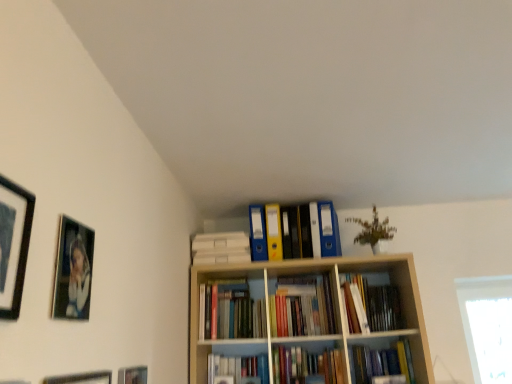
How much space does matte black picture frame at lower left, which is the third picture frame in top-to-bottom order, occupy vertically?

matte black picture frame at lower left, which is the third picture frame in top-to-bottom order, is 5.63 inches tall.

What do you see at coordinates (375, 304) in the screenshot? I see `hardcover books at center, which is the 2th book from bottom to top` at bounding box center [375, 304].

This screenshot has width=512, height=384. Describe the element at coordinates (382, 362) in the screenshot. I see `hardcover book at center, the 1th book when ordered from bottom to top` at that location.

Identify the location of matte plastic folders at upper center, the first book positioned from the top. (294, 231).

What do you see at coordinates (14, 246) in the screenshot? I see `matte black picture frame at upper left, the 4th picture frame when ordered from bottom to top` at bounding box center [14, 246].

Locate an element on the screen. This screenshot has width=512, height=384. matte black picture frame at lower left, which is the 2th picture frame in bottom-to-top order is located at coordinates (133, 375).

Which is behind, matte plastic folders at upper center, which is counted as the 3th book, starting from the bottom, or hardcover book at center, the 1th book when ordered from bottom to top?

matte plastic folders at upper center, which is counted as the 3th book, starting from the bottom, is further from the camera.

Looking at this image, from the image's perspective, is matte plastic folders at upper center, the first book positioned from the top, positioned above or below hardcover book at center, which appears as the 3th book when viewed from the top?

From the image's perspective, matte plastic folders at upper center, the first book positioned from the top, appears above hardcover book at center, which appears as the 3th book when viewed from the top.

From the picture: Between matte plastic folders at upper center, which is counted as the 3th book, starting from the bottom, and hardcover book at center, the 1th book when ordered from bottom to top, which one has less height?

Standing shorter between the two is hardcover book at center, the 1th book when ordered from bottom to top.

Identify the location of book that is the 2nd object located above the hardcover book at center, which appears as the 3th book when viewed from the top (from the image's perspective). The height and width of the screenshot is (384, 512). (294, 231).

Could you tell me if matte plastic folders at upper center, the first book positioned from the top, is facing hardcover books at center, arranged as the second book when viewed from the top?

No, matte plastic folders at upper center, the first book positioned from the top, is not turned towards hardcover books at center, arranged as the second book when viewed from the top.

Between matte plastic folders at upper center, which is counted as the 3th book, starting from the bottom, and hardcover books at center, arranged as the second book when viewed from the top, which one has smaller width?

With smaller width is matte plastic folders at upper center, which is counted as the 3th book, starting from the bottom.

Which is nearer, (274,231) or (367,319)?

The point (367,319) is in front.

The image size is (512, 384). I want to click on the 1st book located beneath the matte plastic folders at upper center, the first book positioned from the top (from a real-world perspective), so click(x=375, y=304).

From a real-world perspective, who is located lower, matte black picture frame at lower left, which is the third picture frame in top-to-bottom order, or hardcover books at center, which is the 2th book from bottom to top?

matte black picture frame at lower left, which is the third picture frame in top-to-bottom order, from a real-world perspective.

Does matte black picture frame at lower left, which is the 2th picture frame in bottom-to-top order, contain hardcover books at center, which is the 2th book from bottom to top?

No, hardcover books at center, which is the 2th book from bottom to top, is not a part of matte black picture frame at lower left, which is the 2th picture frame in bottom-to-top order.

Is matte black picture frame at lower left, which is the 2th picture frame in bottom-to-top order, shorter than hardcover books at center, which is the 2th book from bottom to top?

Indeed, matte black picture frame at lower left, which is the 2th picture frame in bottom-to-top order, has a lesser height compared to hardcover books at center, which is the 2th book from bottom to top.

How distant is matte black picture frame at upper left, the 4th picture frame when ordered from bottom to top, from metallic silver picture frame at upper left, marked as the second picture frame in a top-to-bottom arrangement?

6.16 inches.

Does matte black picture frame at upper left, the 4th picture frame when ordered from bottom to top, turn towards metallic silver picture frame at upper left, marked as the second picture frame in a top-to-bottom arrangement?

No.

Is matte black picture frame at upper left, positioned as the 1th picture frame in top-to-bottom order, smaller than metallic silver picture frame at upper left, marked as the second picture frame in a top-to-bottom arrangement?

No, matte black picture frame at upper left, positioned as the 1th picture frame in top-to-bottom order, is not smaller than metallic silver picture frame at upper left, marked as the second picture frame in a top-to-bottom arrangement.

Considering the positions of objects matte black picture frame at upper left, positioned as the 1th picture frame in top-to-bottom order, and metallic silver picture frame at upper left, marked as the second picture frame in a top-to-bottom arrangement, in the image provided, who is more to the right, matte black picture frame at upper left, positioned as the 1th picture frame in top-to-bottom order, or metallic silver picture frame at upper left, marked as the second picture frame in a top-to-bottom arrangement,?

Positioned to the right is metallic silver picture frame at upper left, marked as the second picture frame in a top-to-bottom arrangement.

Between matte plastic folders at upper center, which is counted as the 3th book, starting from the bottom, and matte black picture frame at upper left, the 4th picture frame when ordered from bottom to top, which one appears on the left side from the viewer's perspective?

From the viewer's perspective, matte black picture frame at upper left, the 4th picture frame when ordered from bottom to top, appears more on the left side.

Is matte plastic folders at upper center, the first book positioned from the top, behind matte black picture frame at upper left, the 4th picture frame when ordered from bottom to top?

That is True.

How different are the orientations of matte plastic folders at upper center, the first book positioned from the top, and matte black picture frame at upper left, the 4th picture frame when ordered from bottom to top, in degrees?

The angular difference between matte plastic folders at upper center, the first book positioned from the top, and matte black picture frame at upper left, the 4th picture frame when ordered from bottom to top, is 88.9 degrees.

From the image's perspective, between matte plastic folders at upper center, the first book positioned from the top, and matte black picture frame at upper left, positioned as the 1th picture frame in top-to-bottom order, who is located below?

matte plastic folders at upper center, the first book positioned from the top, appears lower in the image.

Is metallic silver picture frame at upper left, acting as the third picture frame starting from the bottom, taller or shorter than matte black picture frame at upper left, the 4th picture frame when ordered from bottom to top?

In the image, metallic silver picture frame at upper left, acting as the third picture frame starting from the bottom, appears to be shorter than matte black picture frame at upper left, the 4th picture frame when ordered from bottom to top.

Considering the relative sizes of metallic silver picture frame at upper left, marked as the second picture frame in a top-to-bottom arrangement, and matte black picture frame at upper left, the 4th picture frame when ordered from bottom to top, in the image provided, is metallic silver picture frame at upper left, marked as the second picture frame in a top-to-bottom arrangement, thinner than matte black picture frame at upper left, the 4th picture frame when ordered from bottom to top,?

Indeed, metallic silver picture frame at upper left, marked as the second picture frame in a top-to-bottom arrangement, has a lesser width compared to matte black picture frame at upper left, the 4th picture frame when ordered from bottom to top.

Looking at this image, is metallic silver picture frame at upper left, acting as the third picture frame starting from the bottom, not near matte black picture frame at upper left, the 4th picture frame when ordered from bottom to top?

metallic silver picture frame at upper left, acting as the third picture frame starting from the bottom, is near matte black picture frame at upper left, the 4th picture frame when ordered from bottom to top, not far away.

Choose the correct answer: Is metallic silver picture frame at upper left, acting as the third picture frame starting from the bottom, inside matte black picture frame at upper left, positioned as the 1th picture frame in top-to-bottom order, or outside it?

metallic silver picture frame at upper left, acting as the third picture frame starting from the bottom, is outside matte black picture frame at upper left, positioned as the 1th picture frame in top-to-bottom order.

The width and height of the screenshot is (512, 384). What are the coordinates of `the 2nd book above the matte black picture frame at lower left, which is counted as the fourth picture frame, starting from the top (from a real-world perspective)` in the screenshot? It's located at (375, 304).

Is point (53, 381) in front of point (369, 302)?

Yes, point (53, 381) is closer to viewer.

From a real-world perspective, is matte black picture frame at lower left, which is counted as the 1th picture frame, starting from the bottom, physically below hardcover books at center, arranged as the second book when viewed from the top?

Yes, from a real-world perspective, matte black picture frame at lower left, which is counted as the 1th picture frame, starting from the bottom, is below hardcover books at center, arranged as the second book when viewed from the top.

Who is shorter, matte black picture frame at lower left, which is counted as the 1th picture frame, starting from the bottom, or hardcover books at center, which is the 2th book from bottom to top?

hardcover books at center, which is the 2th book from bottom to top, is shorter.

Find the location of a particular element. The height and width of the screenshot is (384, 512). the 2nd book above the hardcover book at center, the 1th book when ordered from bottom to top (from a real-world perspective) is located at coordinates (294, 231).

Where is `book that is the 1st object located below the matte plastic folders at upper center, which is counted as the 3th book, starting from the bottom (from the image's perspective)`? book that is the 1st object located below the matte plastic folders at upper center, which is counted as the 3th book, starting from the bottom (from the image's perspective) is located at coordinates (375, 304).

When comparing their distances from hardcover books at center, which is the 2th book from bottom to top, does metallic silver picture frame at upper left, marked as the second picture frame in a top-to-bottom arrangement, or hardcover book at center, which appears as the 3th book when viewed from the top, seem closer?

Based on the image, hardcover book at center, which appears as the 3th book when viewed from the top, appears to be nearer to hardcover books at center, which is the 2th book from bottom to top.

Considering their positions, is matte black picture frame at lower left, which is counted as the 1th picture frame, starting from the bottom, positioned further to matte black picture frame at upper left, positioned as the 1th picture frame in top-to-bottom order, than hardcover books at center, which is the 2th book from bottom to top?

hardcover books at center, which is the 2th book from bottom to top, is positioned further to the anchor matte black picture frame at upper left, positioned as the 1th picture frame in top-to-bottom order.

Which object lies further to the anchor point matte plastic folders at upper center, which is counted as the 3th book, starting from the bottom, metallic silver picture frame at upper left, acting as the third picture frame starting from the bottom, or matte black picture frame at lower left, which is the third picture frame in top-to-bottom order?

metallic silver picture frame at upper left, acting as the third picture frame starting from the bottom, is further to matte plastic folders at upper center, which is counted as the 3th book, starting from the bottom.

Based on the photo, based on their spatial positions, is hardcover book at center, which appears as the 3th book when viewed from the top, or matte plastic folders at upper center, which is counted as the 3th book, starting from the bottom, further from matte black picture frame at lower left, which is the 2th picture frame in bottom-to-top order?

hardcover book at center, which appears as the 3th book when viewed from the top, is further to matte black picture frame at lower left, which is the 2th picture frame in bottom-to-top order.

Considering their positions, is matte black picture frame at lower left, which is counted as the fourth picture frame, starting from the top, positioned closer to metallic silver picture frame at upper left, marked as the second picture frame in a top-to-bottom arrangement, than hardcover books at center, arranged as the second book when viewed from the top?

matte black picture frame at lower left, which is counted as the fourth picture frame, starting from the top, is positioned closer to the anchor metallic silver picture frame at upper left, marked as the second picture frame in a top-to-bottom arrangement.

Based on their spatial positions, is metallic silver picture frame at upper left, acting as the third picture frame starting from the bottom, or matte black picture frame at upper left, the 4th picture frame when ordered from bottom to top, closer to matte black picture frame at lower left, which is the 2th picture frame in bottom-to-top order?

metallic silver picture frame at upper left, acting as the third picture frame starting from the bottom, is positioned closer to the anchor matte black picture frame at lower left, which is the 2th picture frame in bottom-to-top order.

Considering their positions, is metallic silver picture frame at upper left, marked as the second picture frame in a top-to-bottom arrangement, positioned further to hardcover books at center, arranged as the second book when viewed from the top, than matte black picture frame at lower left, which is the third picture frame in top-to-bottom order?

Based on the image, metallic silver picture frame at upper left, marked as the second picture frame in a top-to-bottom arrangement, appears to be further to hardcover books at center, arranged as the second book when viewed from the top.

From the image, which object appears to be nearer to matte black picture frame at upper left, the 4th picture frame when ordered from bottom to top, matte black picture frame at lower left, which is the 2th picture frame in bottom-to-top order, or matte plastic folders at upper center, the first book positioned from the top?

Among the two, matte black picture frame at lower left, which is the 2th picture frame in bottom-to-top order, is located nearer to matte black picture frame at upper left, the 4th picture frame when ordered from bottom to top.

Identify the location of book positioned between metallic silver picture frame at upper left, acting as the third picture frame starting from the bottom, and hardcover book at center, the 1th book when ordered from bottom to top, from near to far. This screenshot has width=512, height=384. (375, 304).

This screenshot has height=384, width=512. Find the location of `picture frame between metallic silver picture frame at upper left, acting as the third picture frame starting from the bottom, and hardcover book at center, the 1th book when ordered from bottom to top, from front to back`. picture frame between metallic silver picture frame at upper left, acting as the third picture frame starting from the bottom, and hardcover book at center, the 1th book when ordered from bottom to top, from front to back is located at coordinates (133, 375).

Identify the location of book between matte black picture frame at upper left, positioned as the 1th picture frame in top-to-bottom order, and hardcover book at center, the 1th book when ordered from bottom to top, along the z-axis. (375, 304).

The image size is (512, 384). What are the coordinates of `book between matte plastic folders at upper center, the first book positioned from the top, and hardcover book at center, which appears as the 3th book when viewed from the top, vertically` in the screenshot? It's located at (375, 304).